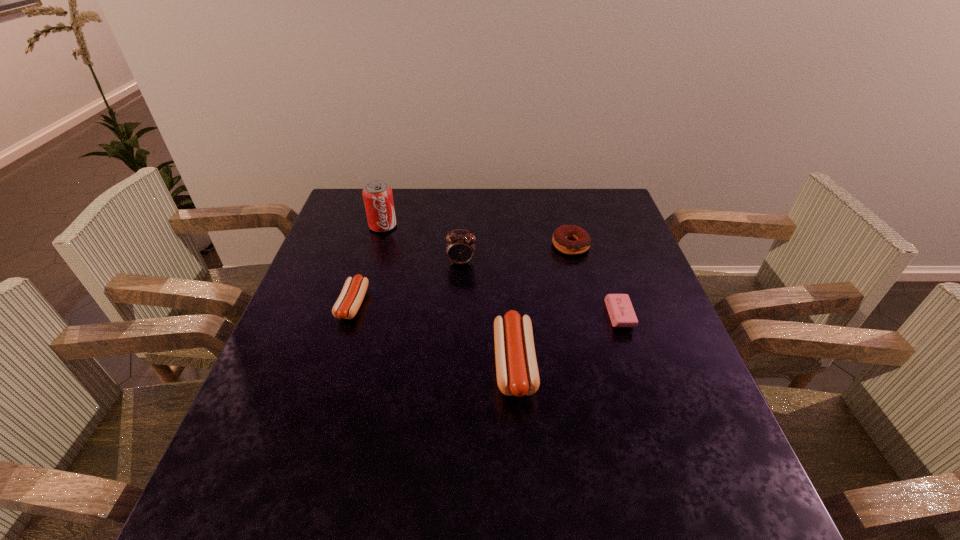
Where is `vacant space situated on the right of the right sausage`? This screenshot has height=540, width=960. vacant space situated on the right of the right sausage is located at coordinates (603, 364).

This screenshot has height=540, width=960. What are the coordinates of `vacant position located on the back of the doughnut` in the screenshot? It's located at (558, 195).

In order to click on vacant space situated 0.190m on the right of the soda can in this screenshot , I will do `click(458, 226)`.

This screenshot has width=960, height=540. I want to click on vacant space located 0.210m on the back of the shortest object, so click(597, 249).

At what (x,y) coordinates should I click in order to perform the action: click on blank space located on the face of the fifth shortest object. Please return your answer as a coordinate pair (x, y). This screenshot has width=960, height=540. Looking at the image, I should click on (458, 329).

You are a GUI agent. You are given a task and a screenshot of the screen. Output one action in this format:
    pyautogui.click(x=<x>, y=<y>)
    Task: Click on the object that is at the far edge
    Image resolution: width=960 pixels, height=540 pixels.
    Given the screenshot: What is the action you would take?
    [378, 199]

The image size is (960, 540). I want to click on sausage present at the left edge, so click(348, 303).

This screenshot has height=540, width=960. What are the coordinates of `soda can positioned at the left edge` in the screenshot? It's located at click(x=378, y=199).

Locate an element on the screen. This screenshot has width=960, height=540. doughnut present at the right edge is located at coordinates (582, 242).

Where is `eraser positioned at the right edge`? eraser positioned at the right edge is located at coordinates (620, 309).